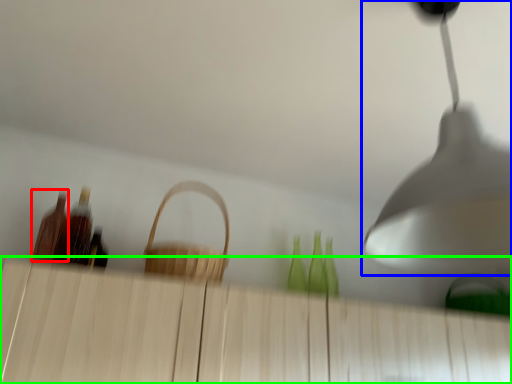
Question: Based on their relative distances, which object is farther from bottle (highlighted by a red box)? Choose from lamp (highlighted by a blue box) and dresser (highlighted by a green box).

Choices:
 (A) lamp
 (B) dresser

Answer: (A)